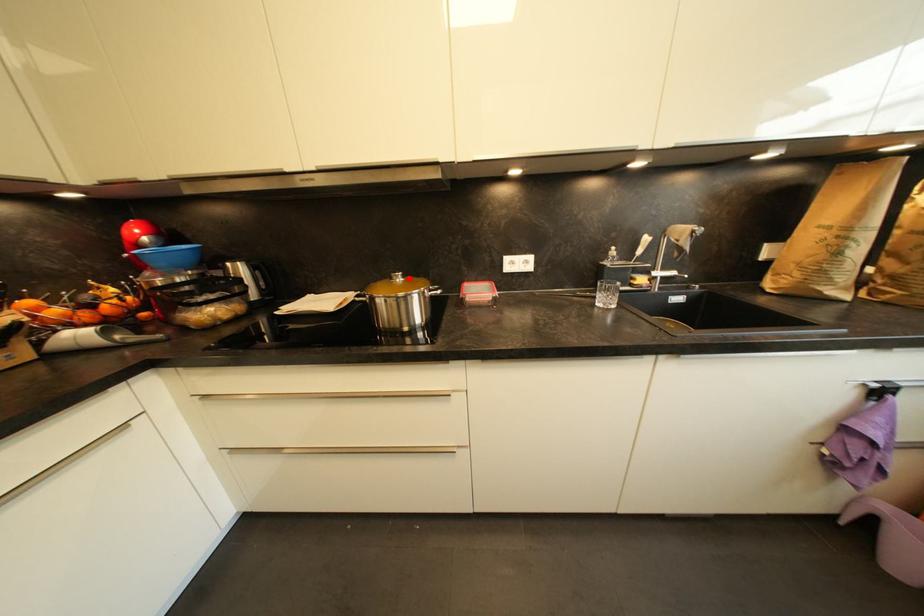
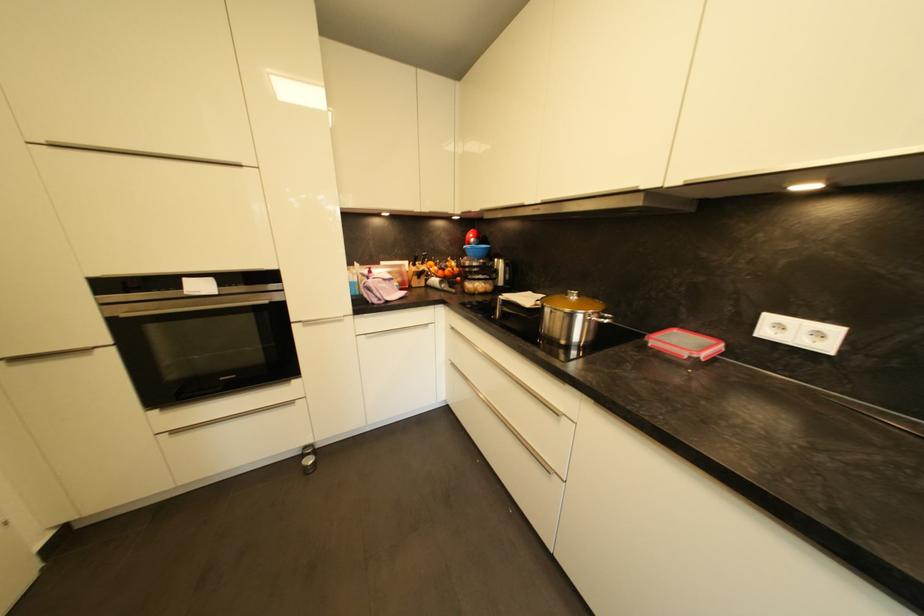
Where in the second image is the point corresponding to the highlighted location from the first image?

(584, 298)